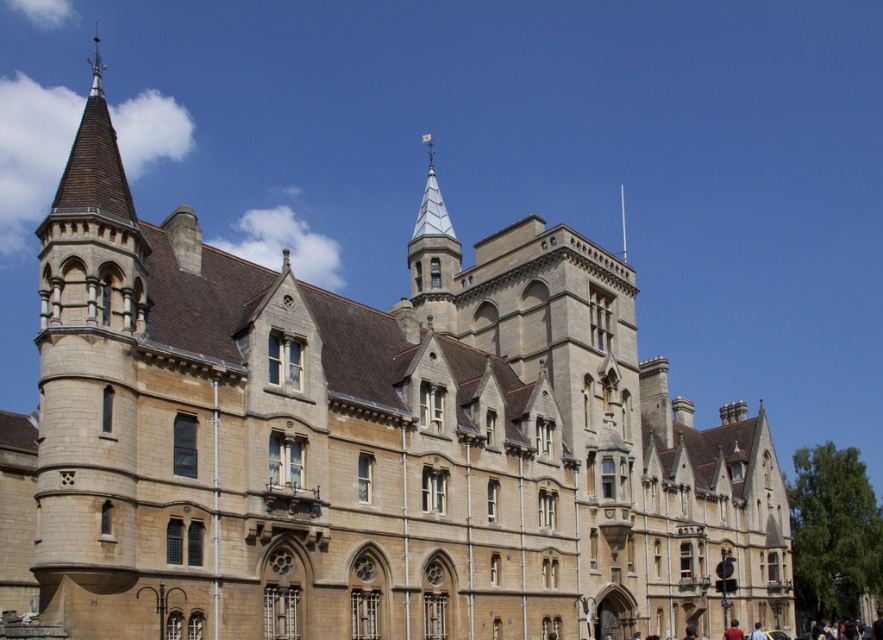
Between point (726, 628) and point (757, 621), which one is positioned in front?

Point (726, 628)

Is red fabric person at lower right positioned behind blurred yellow shirt at lower right?

That is False.

Who is more forward, [734,625] or [756,636]?

Point [756,636] is in front.

You are a GUI agent. You are given a task and a screenshot of the screen. Output one action in this format:
    pyautogui.click(x=<x>, y=<y>)
    Task: Click on the red fabric person at lower right
    
    Given the screenshot: What is the action you would take?
    pyautogui.click(x=733, y=632)

Does white glass spire at upper center lie in front of red fabric person at lower right?

No, it is behind red fabric person at lower right.

Is point (432, 236) less distant than point (729, 632)?

No, (432, 236) is behind (729, 632).

Is point (409, 260) positioned after point (727, 637)?

Yes, point (409, 260) is farther from viewer.

Identify the location of white glass spire at upper center. The image size is (883, 640). (432, 237).

Does white glass spire at upper center have a greater height compared to blurred yellow shirt at lower right?

Correct, white glass spire at upper center is much taller as blurred yellow shirt at lower right.

Describe the element at coordinates (432, 237) in the screenshot. This screenshot has height=640, width=883. I see `white glass spire at upper center` at that location.

I want to click on white glass spire at upper center, so click(432, 237).